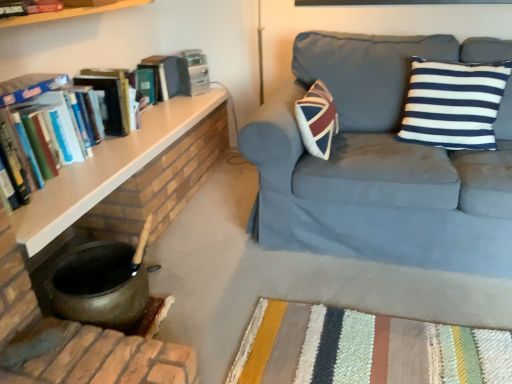
Identify the location of suede blue couch at upper right. The height and width of the screenshot is (384, 512). (381, 163).

Where is `navy blue striped cushion at upper right`? navy blue striped cushion at upper right is located at coordinates (453, 104).

In order to face navy blue striped cushion at upper right, should I rotate leftwards or rightwards?

Rotate your view right by about 25.074°.

Where is `hardcover books at left, which is the 1th book from bottom to top`? This screenshot has width=512, height=384. hardcover books at left, which is the 1th book from bottom to top is located at coordinates (119, 95).

Identify the location of wooden shelf at left. point(129,179).

Is navy blue striped cushion at upper right in contact with hardcover book at upper left?

No, navy blue striped cushion at upper right is not next to hardcover book at upper left.

From the image's perspective, which one is positioned higher, navy blue striped cushion at upper right or hardcover book at upper left?

hardcover book at upper left appears higher in the image.

Could you tell me if navy blue striped cushion at upper right is facing hardcover book at upper left?

No, navy blue striped cushion at upper right does not turn towards hardcover book at upper left.

From the picture: From a real-world perspective, is navy blue striped cushion at upper right positioned over hardcover book at upper left based on gravity?

Yes, from a real-world perspective, navy blue striped cushion at upper right is on top of hardcover book at upper left.

Is hardcover books at left, which is the 1th book from bottom to top, far from navy blue striped cushion at upper right?

Indeed, hardcover books at left, which is the 1th book from bottom to top, is not near navy blue striped cushion at upper right.

Which is more to the left, hardcover books at left, the 2th book positioned from the top, or navy blue striped cushion at upper right?

hardcover books at left, the 2th book positioned from the top.

Is hardcover books at left, the 2th book positioned from the top, oriented away from navy blue striped cushion at upper right?

No, hardcover books at left, the 2th book positioned from the top, is not facing the opposite direction of navy blue striped cushion at upper right.

I want to click on pillow behind the hardcover books at left, which is the 1th book from bottom to top, so click(453, 104).

Considering the sizes of objects hardcover book at upper left, placed as the second book when sorted from bottom to top, and hardcover book at upper left in the image provided, who is smaller, hardcover book at upper left, placed as the second book when sorted from bottom to top, or hardcover book at upper left?

hardcover book at upper left, placed as the second book when sorted from bottom to top.

Can you tell me how much hardcover book at upper left, placed as the second book when sorted from bottom to top, and hardcover book at upper left differ in facing direction?

The angular difference between hardcover book at upper left, placed as the second book when sorted from bottom to top, and hardcover book at upper left is 3.34 degrees.

Could you tell me if hardcover book at upper left, placed as the second book when sorted from bottom to top, is facing hardcover book at upper left?

No, hardcover book at upper left, placed as the second book when sorted from bottom to top, is not turned towards hardcover book at upper left.

This screenshot has height=384, width=512. In order to click on the 1st book in front of the hardcover book at upper left, starting your count from the anchor in this screenshot , I will do `click(28, 7)`.

How different are the orientations of hardcover book at upper left and hardcover books at left, which is the 1th book from bottom to top, in degrees?

The angle between the facing direction of hardcover book at upper left and the facing direction of hardcover books at left, which is the 1th book from bottom to top, is 4.4 degrees.

Does hardcover book at upper left have a greater width compared to hardcover books at left, which is the 1th book from bottom to top?

Incorrect, the width of hardcover book at upper left does not surpass that of hardcover books at left, which is the 1th book from bottom to top.

From a real-world perspective, is hardcover book at upper left beneath hardcover books at left, the 2th book positioned from the top?

Yes, from a real-world perspective, hardcover book at upper left is below hardcover books at left, the 2th book positioned from the top.

How many degrees apart are the facing directions of suede blue couch at upper right and hardcover book at upper left?

They differ by 86 degrees in their facing directions.

Is suede blue couch at upper right thinner than hardcover book at upper left?

In fact, suede blue couch at upper right might be wider than hardcover book at upper left.

Based on the photo, from a real-world perspective, is suede blue couch at upper right above or below hardcover book at upper left?

From a real-world perspective, suede blue couch at upper right is physically below hardcover book at upper left.

Which is farther from the camera, [264,170] or [160,73]?

The point [160,73] is farther from the camera.

From the image's perspective, is hardcover book at upper left, positioned as the 1th book in top-to-bottom order, located beneath suede blue couch at upper right?

No.

Is suede blue couch at upper right inside hardcover book at upper left, positioned as the 1th book in top-to-bottom order?

No, suede blue couch at upper right is not a part of hardcover book at upper left, positioned as the 1th book in top-to-bottom order.

Is hardcover book at upper left, positioned as the 1th book in top-to-bottom order, further to camera compared to suede blue couch at upper right?

Yes, it is behind suede blue couch at upper right.

Consider the image. Which object is thinner, hardcover book at upper left, positioned as the 1th book in top-to-bottom order, or suede blue couch at upper right?

hardcover book at upper left, positioned as the 1th book in top-to-bottom order, is thinner.

Is suede blue couch at upper right bigger than hardcover book at upper left, positioned as the 1th book in top-to-bottom order?

Yes, suede blue couch at upper right is bigger than hardcover book at upper left, positioned as the 1th book in top-to-bottom order.

How different are the orientations of suede blue couch at upper right and hardcover book at upper left, placed as the second book when sorted from bottom to top, in degrees?

suede blue couch at upper right and hardcover book at upper left, placed as the second book when sorted from bottom to top, are facing 89.4 degrees away from each other.

Can you confirm if suede blue couch at upper right is positioned to the right of hardcover book at upper left, placed as the second book when sorted from bottom to top?

Indeed, suede blue couch at upper right is positioned on the right side of hardcover book at upper left, placed as the second book when sorted from bottom to top.

Is suede blue couch at upper right facing away from hardcover book at upper left, placed as the second book when sorted from bottom to top?

No.

Identify the location of pillow on the right of hardcover book at upper left. This screenshot has width=512, height=384. (453, 104).

The image size is (512, 384). In order to click on pillow that appears behind the hardcover books at left, the 2th book positioned from the top in this screenshot , I will do `click(453, 104)`.

Based on their spatial positions, is hardcover books at left, the 2th book positioned from the top, or hardcover book at upper left further from suede blue couch at upper right?

hardcover book at upper left.

When comparing their distances from hardcover book at upper left, placed as the second book when sorted from bottom to top, does suede blue couch at upper right or hardcover books at left, which is the 1th book from bottom to top, seem closer?

Based on the image, hardcover books at left, which is the 1th book from bottom to top, appears to be nearer to hardcover book at upper left, placed as the second book when sorted from bottom to top.

When comparing their distances from hardcover book at upper left, does suede blue couch at upper right or wooden shelf at left seem closer?

wooden shelf at left lies closer to hardcover book at upper left than the other object.

Estimate the real-world distances between objects in this image. Which object is closer to navy blue striped cushion at upper right, hardcover book at upper left or hardcover books at left, which is the 1th book from bottom to top?

hardcover books at left, which is the 1th book from bottom to top, is positioned closer to the anchor navy blue striped cushion at upper right.

In the scene shown: Based on their spatial positions, is navy blue striped cushion at upper right or hardcover book at upper left closer to wooden shelf at left?

hardcover book at upper left is closer to wooden shelf at left.

When comparing their distances from hardcover books at left, which is the 1th book from bottom to top, does hardcover book at upper left, placed as the second book when sorted from bottom to top, or suede blue couch at upper right seem further?

Based on the image, suede blue couch at upper right appears to be further to hardcover books at left, which is the 1th book from bottom to top.

From the image, which object appears to be nearer to wooden shelf at left, hardcover books at left, the 2th book positioned from the top, or suede blue couch at upper right?

hardcover books at left, the 2th book positioned from the top, is positioned closer to the anchor wooden shelf at left.

When comparing their distances from wooden shelf at left, does hardcover book at upper left or navy blue striped cushion at upper right seem further?

navy blue striped cushion at upper right.

Locate an element on the screen. The image size is (512, 384). book between hardcover books at left, the 2th book positioned from the top, and hardcover book at upper left, along the z-axis is located at coordinates (28, 7).

Locate an element on the screen. Image resolution: width=512 pixels, height=384 pixels. table between hardcover books at left, the 2th book positioned from the top, and suede blue couch at upper right is located at coordinates (129, 179).

Identify the location of book located between hardcover books at left, the 2th book positioned from the top, and navy blue striped cushion at upper right in the left-right direction. The width and height of the screenshot is (512, 384). (28, 7).

Image resolution: width=512 pixels, height=384 pixels. I want to click on table positioned between hardcover books at left, the 2th book positioned from the top, and hardcover book at upper left from near to far, so click(129, 179).